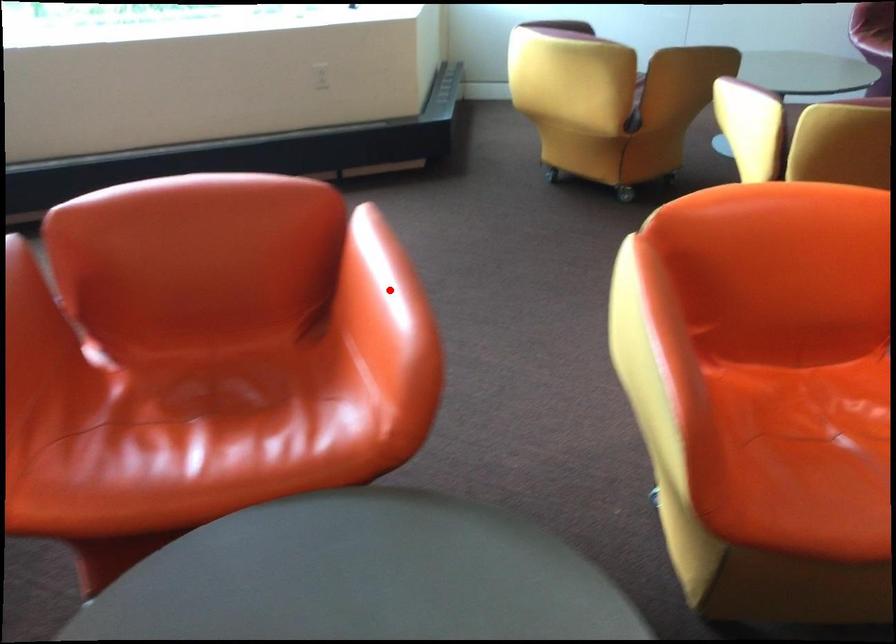
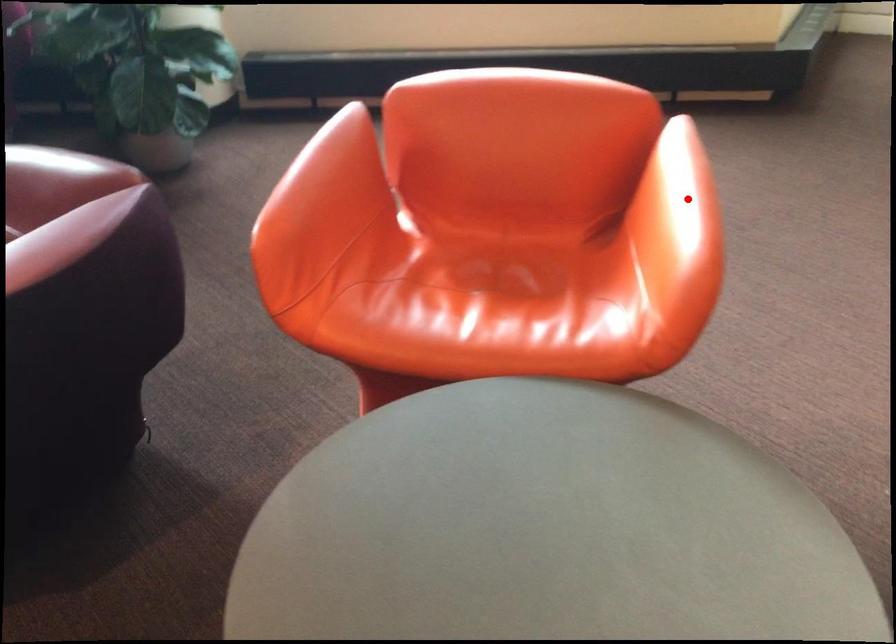
I am providing you with two images of the same scene from different viewpoints. A red point is marked on the first image and another point is marked on the second image. Is the red point in image1 aligned with the point shown in image2?

Yes